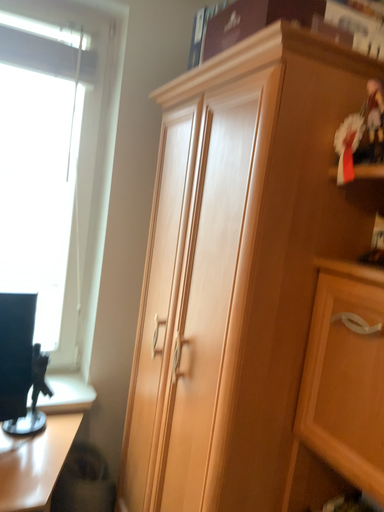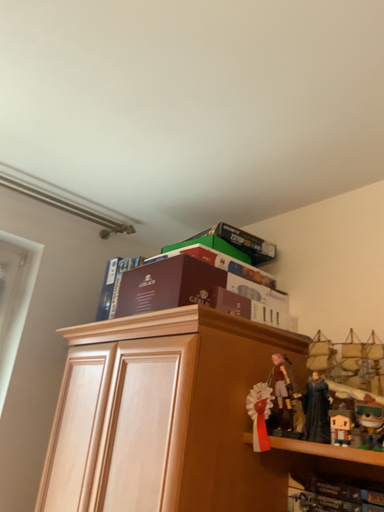
Question: Which way did the camera rotate in the video?

Choices:
 (A) rotated upward
 (B) rotated downward

Answer: (A)